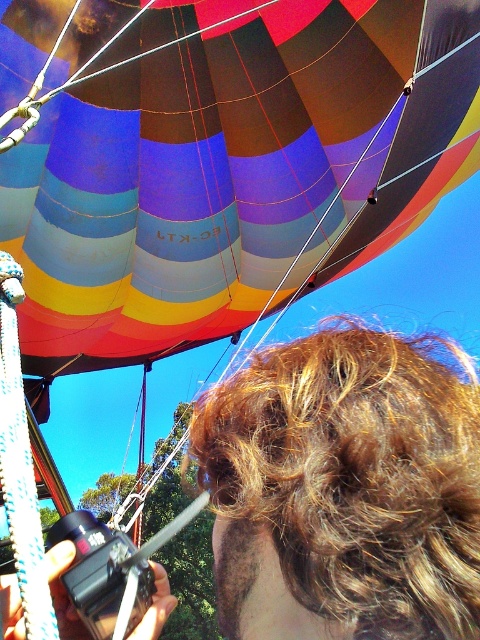
Question: Is multicolored fabric balloon at upper center wider than shiny brown hair at center?

Choices:
 (A) yes
 (B) no

Answer: (A)

Question: Does multicolored fabric balloon at upper center come in front of shiny brown hair at center?

Choices:
 (A) no
 (B) yes

Answer: (A)

Question: Is multicolored fabric balloon at upper center to the right of shiny brown hair at center from the viewer's perspective?

Choices:
 (A) yes
 (B) no

Answer: (B)

Question: Which point is closer to the camera?

Choices:
 (A) (81, 624)
 (B) (453, 22)

Answer: (A)

Question: Which point is farther to the camera?

Choices:
 (A) multicolored fabric balloon at upper center
 (B) shiny brown hair at center

Answer: (A)